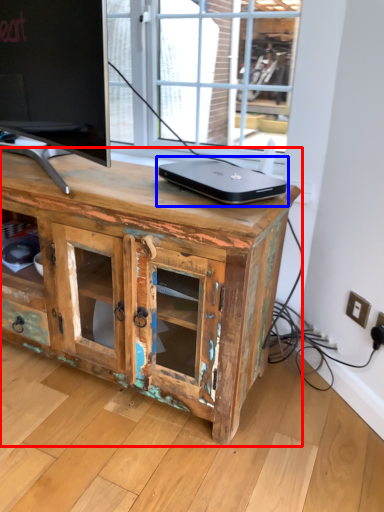
Question: Which point is further to the camera, chest of drawers (highlighted by a red box) or laptop (highlighted by a blue box)?

Choices:
 (A) chest of drawers
 (B) laptop

Answer: (B)